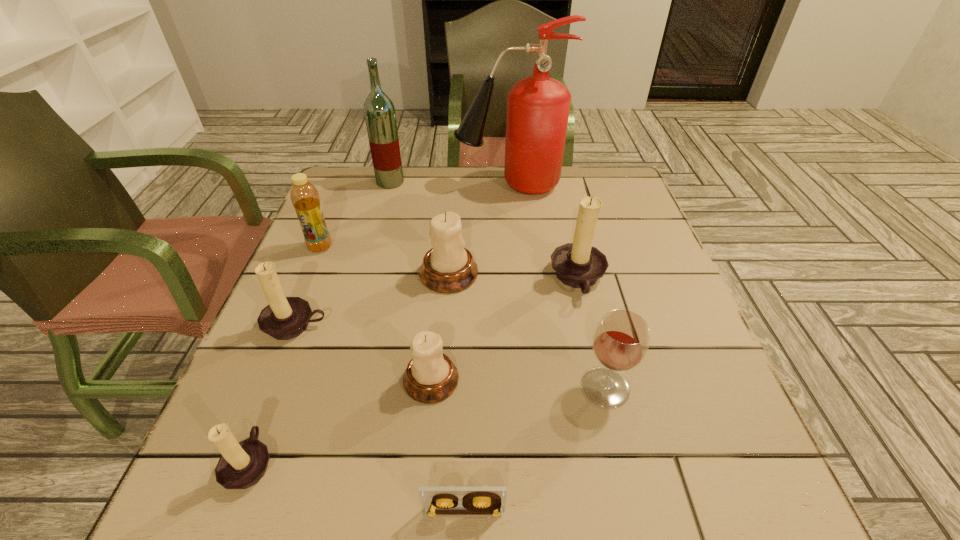
Identify the location of the tallest object. (538, 107).

The height and width of the screenshot is (540, 960). Identify the location of red fire extinguisher. (538, 107).

I want to click on the seventh object from right to left, so click(x=379, y=111).

Where is `green liquor`? Image resolution: width=960 pixels, height=540 pixels. green liquor is located at coordinates (379, 111).

This screenshot has width=960, height=540. What are the coordinates of `the rightmost brown candle holder` in the screenshot? It's located at (579, 265).

Locate an element on the screen. This screenshot has width=960, height=540. the farthest brown candle holder is located at coordinates (579, 265).

Locate an element on the screen. bottle is located at coordinates (304, 196).

The width and height of the screenshot is (960, 540). Identify the location of the bigger white candle holder. (448, 267).

Locate an element on the screen. Image resolution: width=960 pixels, height=540 pixels. the fifth nearest object is located at coordinates (284, 318).

Locate an element on the screen. Image resolution: width=960 pixels, height=540 pixels. the second nearest brown candle holder is located at coordinates (284, 318).